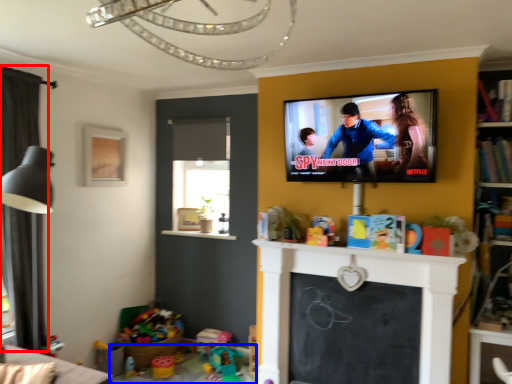
Question: Which of the following is the farthest to the observer, curtain (highlighted by a red box) or table (highlighted by a blue box)?

Choices:
 (A) curtain
 (B) table

Answer: (B)